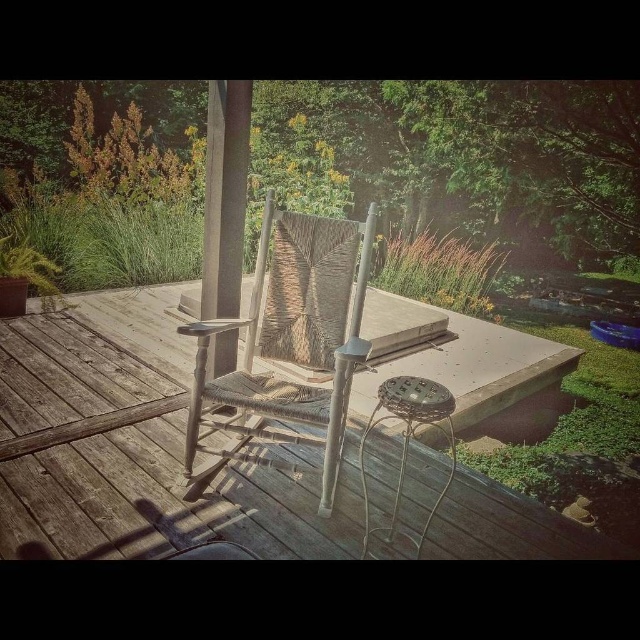
Question: Which is farther from the weathered wood deck at center?

Choices:
 (A) woven wood chair at center
 (B) metallic wire stool at center

Answer: (B)

Question: Can you confirm if woven wood chair at center is thinner than metallic wire stool at center?

Choices:
 (A) no
 (B) yes

Answer: (A)

Question: Does weathered wood deck at center have a smaller size compared to woven wood chair at center?

Choices:
 (A) yes
 (B) no

Answer: (B)

Question: Which point is closer to the camera taking this photo?

Choices:
 (A) (452, 385)
 (B) (403, 378)
 (C) (374, 211)

Answer: (B)

Question: Which point is farther to the camera?

Choices:
 (A) weathered wood deck at center
 (B) woven wood chair at center

Answer: (A)

Question: Does weathered wood deck at center appear over woven wood chair at center?

Choices:
 (A) no
 (B) yes

Answer: (A)